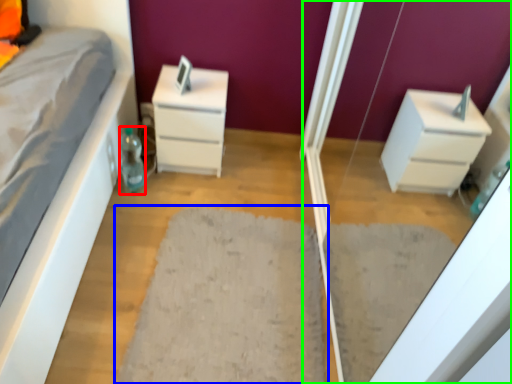
Question: Estimate the real-world distances between objects in this image. Which object is farther from bottle (highlighted by a red box), doormat (highlighted by a blue box) or screen door (highlighted by a green box)?

Choices:
 (A) doormat
 (B) screen door

Answer: (B)